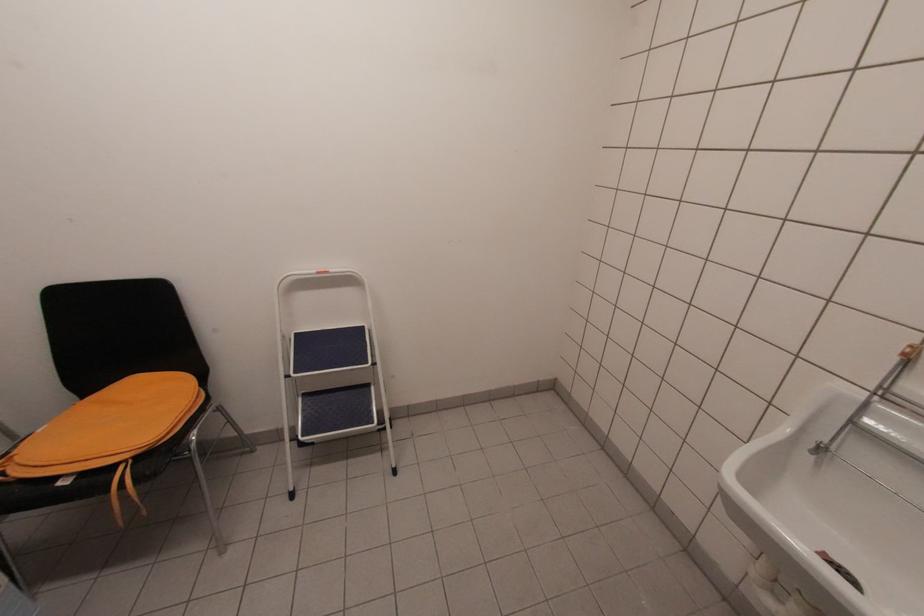
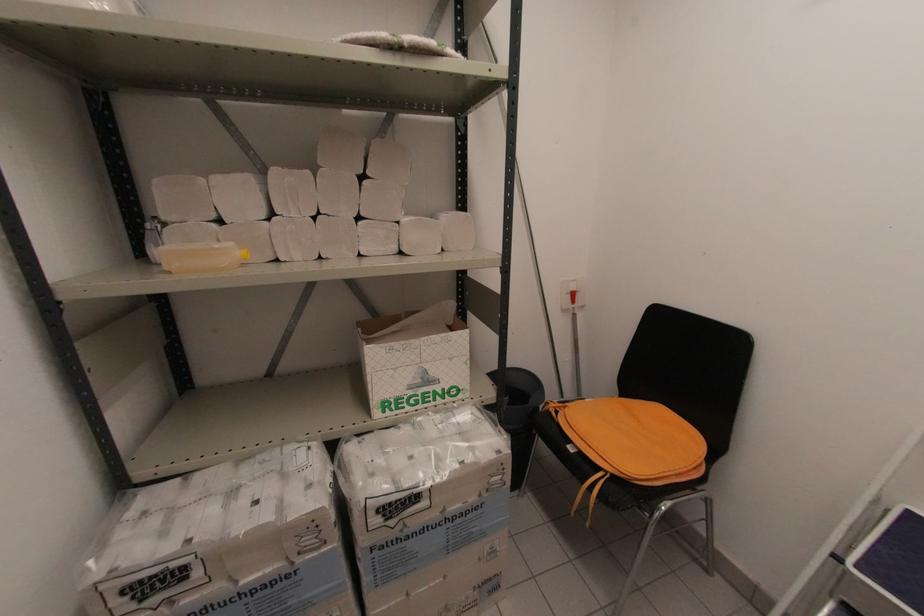
Question: How did the camera likely rotate?

Choices:
 (A) Left
 (B) Right
 (C) Up
 (D) Down

Answer: (A)